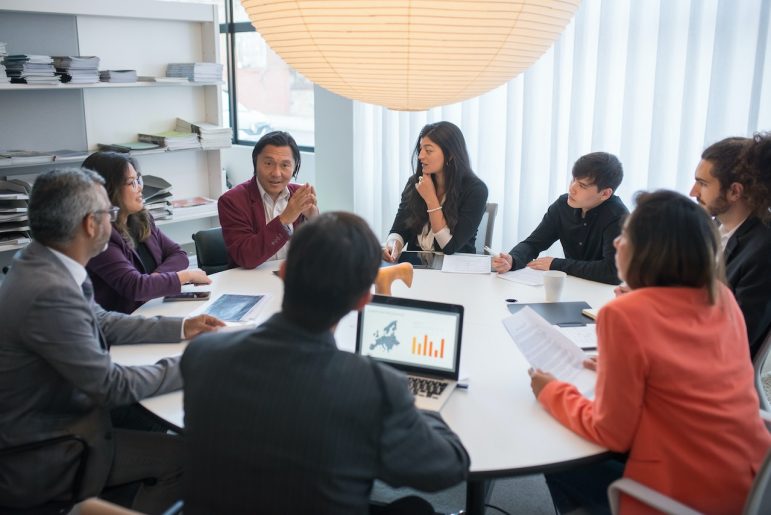
Image resolution: width=771 pixels, height=515 pixels. Find the location of `white shelf`. white shelf is located at coordinates (123, 84), (155, 153), (177, 219), (190, 259).